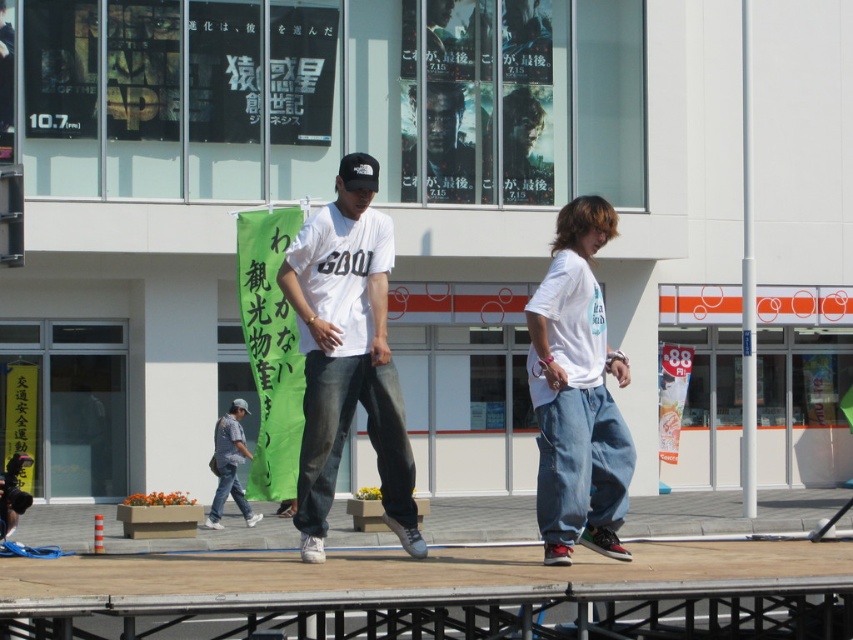
You are standing at the front of the stage and looking towards the building with the movie posters. Which of the two points, point (381, 401) or point (538, 428), is closer to you?

Point (381, 401) is closer to you because it is in front of point (538, 428).